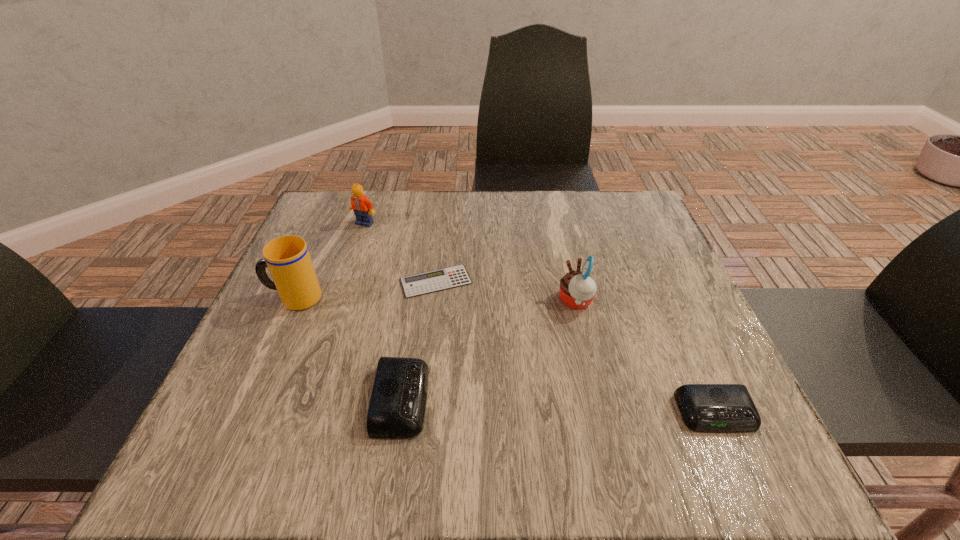
Locate an element on the screen. Image resolution: width=960 pixels, height=540 pixels. the left alarm clock is located at coordinates (397, 406).

Where is `the taller alarm clock`? The height and width of the screenshot is (540, 960). the taller alarm clock is located at coordinates (397, 406).

Where is `the second shortest object`? The width and height of the screenshot is (960, 540). the second shortest object is located at coordinates click(x=725, y=408).

Find the location of a particular element. The image size is (960, 540). the shorter alarm clock is located at coordinates (725, 408).

You are a GUI agent. You are given a task and a screenshot of the screen. Output one action in this format:
    pyautogui.click(x=<x>, y=<y>)
    Task: Click on the fifth object from right to left
    
    Given the screenshot: What is the action you would take?
    pyautogui.click(x=362, y=207)

The height and width of the screenshot is (540, 960). In order to click on the farthest object in this screenshot , I will do `click(362, 207)`.

The height and width of the screenshot is (540, 960). What are the coordinates of `muffin` in the screenshot? It's located at (577, 288).

I want to click on the tallest object, so click(288, 259).

The image size is (960, 540). Identify the location of the leftmost object. (288, 259).

Locate an element on the screen. The width and height of the screenshot is (960, 540). the shortest object is located at coordinates (414, 285).